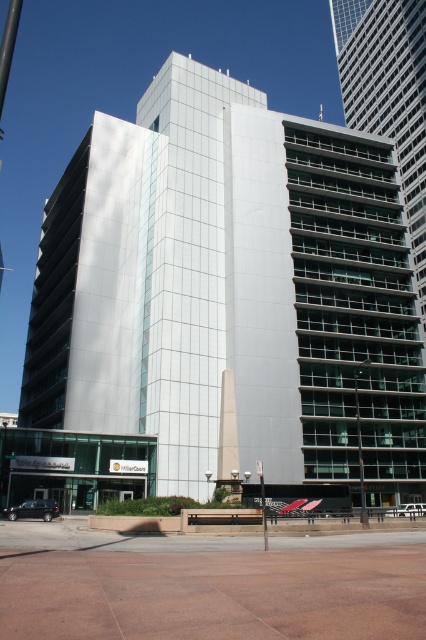
Is the position of metallic pole at right more distant than that of white plastic street sign at center?

That is True.

Can you confirm if metallic pole at right is wider than white plastic street sign at center?

Correct, the width of metallic pole at right exceeds that of white plastic street sign at center.

What do you see at coordinates (359, 444) in the screenshot?
I see `metallic pole at right` at bounding box center [359, 444].

The width and height of the screenshot is (426, 640). Identify the location of metallic pole at right. (359, 444).

Is white glass building at center to the left of metallic pole at right from the viewer's perspective?

Indeed, white glass building at center is positioned on the left side of metallic pole at right.

Can you confirm if white glass building at center is bigger than metallic pole at right?

Yes.

Does point (408, 288) lie behind point (356, 387)?

Yes, point (408, 288) is behind point (356, 387).

The image size is (426, 640). I want to click on white glass building at center, so click(230, 296).

Does white glass building at center have a greater height compared to white plastic street sign at center?

Yes, white glass building at center is taller than white plastic street sign at center.

You are a GUI agent. You are given a task and a screenshot of the screen. Output one action in this format:
    pyautogui.click(x=<x>, y=<y>)
    Task: Click on the white glass building at center
    Image resolution: width=426 pixels, height=640 pixels.
    Given the screenshot: What is the action you would take?
    230,296

This screenshot has height=640, width=426. Identify the location of white glass building at center. (230, 296).